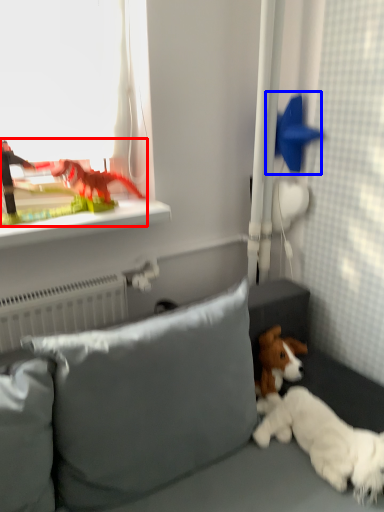
Question: Which point is closer to the camera, toy (highlighted by a red box) or toy (highlighted by a blue box)?

Choices:
 (A) toy
 (B) toy

Answer: (A)